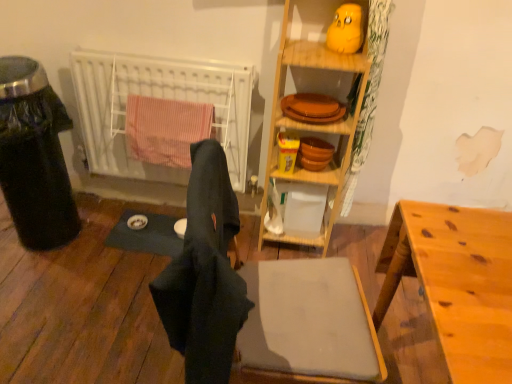
The width and height of the screenshot is (512, 384). I want to click on vacant area that is situated to the right of transparent plastic trash can at left, so click(x=118, y=240).